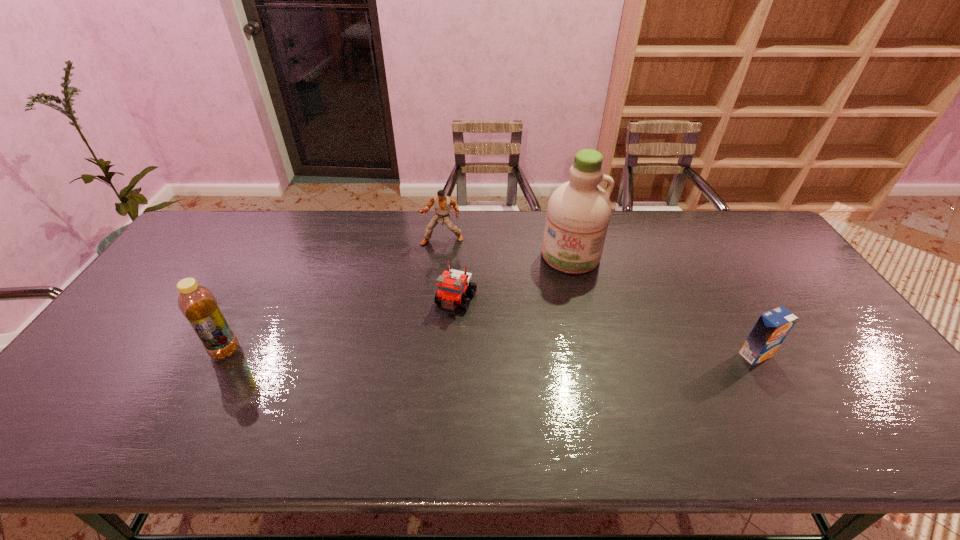
The height and width of the screenshot is (540, 960). I want to click on cleansing agent that is at the far edge, so click(x=578, y=213).

Locate an element on the screen. This screenshot has width=960, height=540. puncher that is at the far edge is located at coordinates (443, 203).

At what (x,y) coordinates should I click in order to perform the action: click on free spot at the far edge of the desktop. Please return your answer as a coordinate pair (x, y). This screenshot has height=540, width=960. Looking at the image, I should click on (353, 210).

In the image, there is a desktop. In order to click on vacant space at the near edge in this screenshot , I will do `click(491, 397)`.

Locate an element on the screen. vacant area at the right edge is located at coordinates (863, 368).

Locate an element on the screen. The height and width of the screenshot is (540, 960). vacant region at the near left corner of the desktop is located at coordinates (64, 403).

You are a GUI agent. You are given a task and a screenshot of the screen. Output one action in this format:
    pyautogui.click(x=<x>, y=<y>)
    Task: Click on the free space between the orange_juice and the bottle
    The width and height of the screenshot is (960, 540).
    Given the screenshot: What is the action you would take?
    pyautogui.click(x=491, y=353)

You are a GUI agent. You are given a task and a screenshot of the screen. Output one action in this format:
    pyautogui.click(x=<x>, y=<y>)
    Task: Click on the free space that is in between the shortest object and the cleansing agent
    This screenshot has height=540, width=960.
    Given the screenshot: What is the action you would take?
    [514, 278]

This screenshot has height=540, width=960. In order to click on vacant area that lies between the leftmost object and the third farthest object in this screenshot , I will do `click(341, 325)`.

You are a GUI agent. You are given a task and a screenshot of the screen. Output one action in this format:
    pyautogui.click(x=<x>, y=<y>)
    Task: Click on the vacant area between the puncher and the tallest object
    
    Given the screenshot: What is the action you would take?
    pyautogui.click(x=506, y=248)